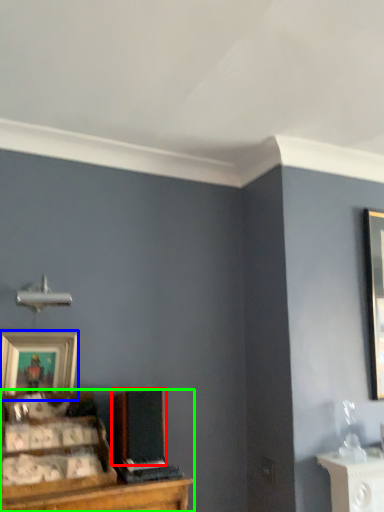
Question: Which object is the farthest from speaker (highlighted by a red box)? Choose among these: picture frame (highlighted by a blue box) or entertainment center (highlighted by a green box).

Choices:
 (A) picture frame
 (B) entertainment center

Answer: (A)